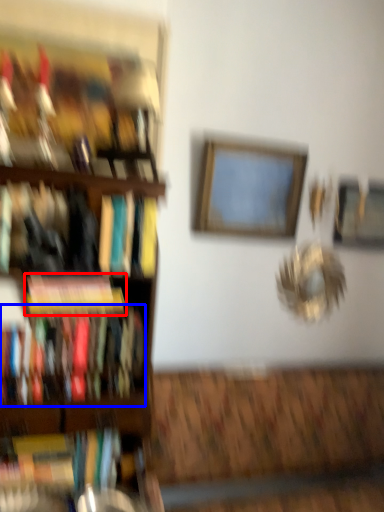
Question: Which point is further to the camera, book (highlighted by a red box) or book (highlighted by a blue box)?

Choices:
 (A) book
 (B) book

Answer: (A)